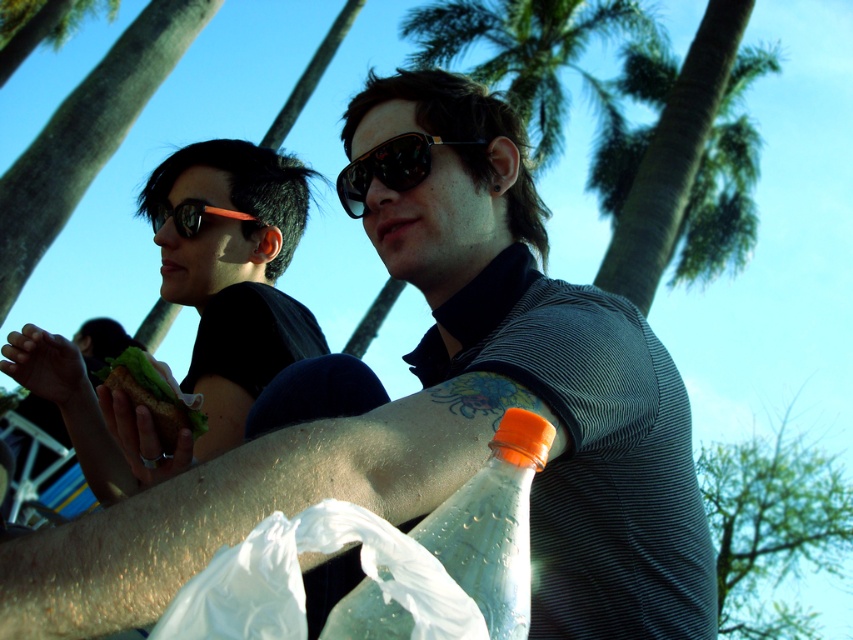
Is green leafy palm tree at upper left to the left of matte orange sunglasses at upper left from the viewer's perspective?

Correct, you'll find green leafy palm tree at upper left to the left of matte orange sunglasses at upper left.

Image resolution: width=853 pixels, height=640 pixels. Find the location of `green leafy palm tree at upper left`. green leafy palm tree at upper left is located at coordinates (36, 26).

You are a GUI agent. You are given a task and a screenshot of the screen. Output one action in this format:
    pyautogui.click(x=<x>, y=<y>)
    Task: Click on the green leafy palm tree at upper left
    
    Given the screenshot: What is the action you would take?
    pyautogui.click(x=36, y=26)

Does transparent plastic bag at lower center appear on the left side of green leafy palm tree at upper center?

Indeed, transparent plastic bag at lower center is positioned on the left side of green leafy palm tree at upper center.

Who is positioned more to the left, transparent plastic bag at lower center or green leafy palm tree at upper center?

transparent plastic bag at lower center

Where is `transparent plastic bag at lower center`? The image size is (853, 640). transparent plastic bag at lower center is located at coordinates (302, 582).

Locate an element on the screen. The height and width of the screenshot is (640, 853). transparent plastic bag at lower center is located at coordinates (302, 582).

The width and height of the screenshot is (853, 640). What do you see at coordinates (527, 52) in the screenshot?
I see `green leafy palm tree at upper center` at bounding box center [527, 52].

What do you see at coordinates (527, 52) in the screenshot?
I see `green leafy palm tree at upper center` at bounding box center [527, 52].

I want to click on green leafy palm tree at upper center, so click(527, 52).